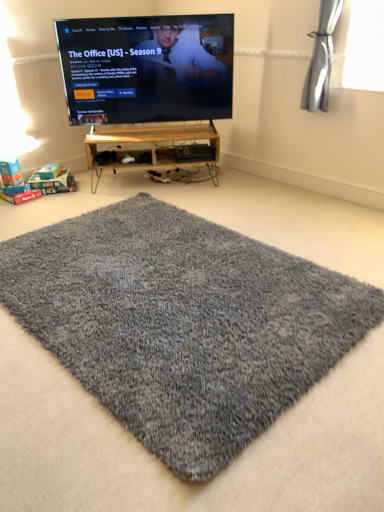
Image resolution: width=384 pixels, height=512 pixels. Identify the location of space that is in front of wooden shelf at center. (178, 203).